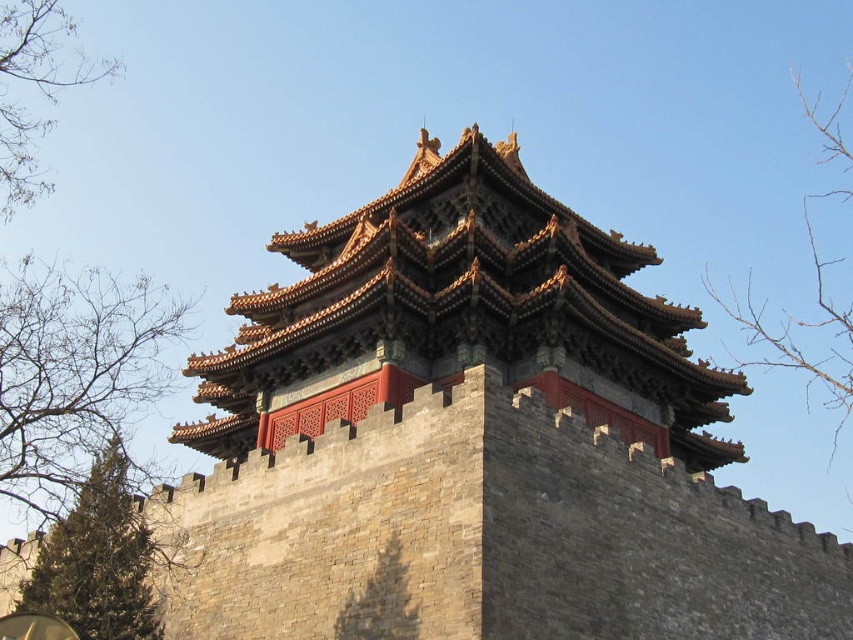
Question: Is bare branches at left smaller than bare branches at upper left?

Choices:
 (A) no
 (B) yes

Answer: (A)

Question: Which point is farther to the camera?

Choices:
 (A) (824, 369)
 (B) (33, 65)

Answer: (A)

Question: Does bare branches at left appear under bare branches at upper right?

Choices:
 (A) yes
 (B) no

Answer: (A)

Question: Which is farther from the bare branches at upper left?

Choices:
 (A) bare branches at left
 (B) bare branches at upper right
 (C) green textured tree at lower left

Answer: (B)

Question: Observing the image, what is the correct spatial positioning of bare branches at left in reference to bare branches at upper left?

Choices:
 (A) right
 (B) left

Answer: (A)

Question: Based on their relative distances, which object is farther from the bare branches at left?

Choices:
 (A) bare branches at upper right
 (B) green textured tree at lower left
 (C) bare branches at upper left

Answer: (A)